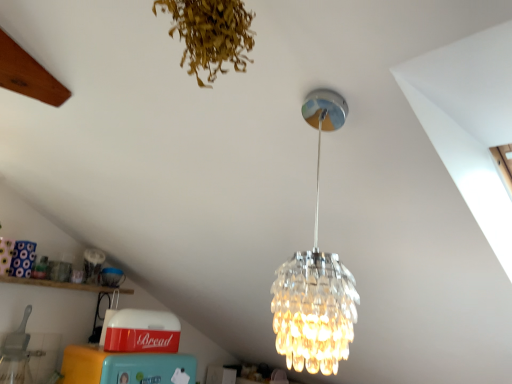
Question: In terms of height, does wooden shelf at lower left look taller or shorter compared to clear glass chandelier at center?

Choices:
 (A) short
 (B) tall

Answer: (A)

Question: Would you say wooden shelf at lower left is to the left or to the right of clear glass chandelier at center in the picture?

Choices:
 (A) left
 (B) right

Answer: (A)

Question: Based on their relative distances, which object is farther from the wooden shelf at lower left?

Choices:
 (A) clear glass chandelier at center
 (B) brown dried leaves at upper center

Answer: (B)

Question: Based on their relative distances, which object is farther from the wooden shelf at lower left?

Choices:
 (A) clear glass chandelier at center
 (B) brown dried leaves at upper center

Answer: (B)